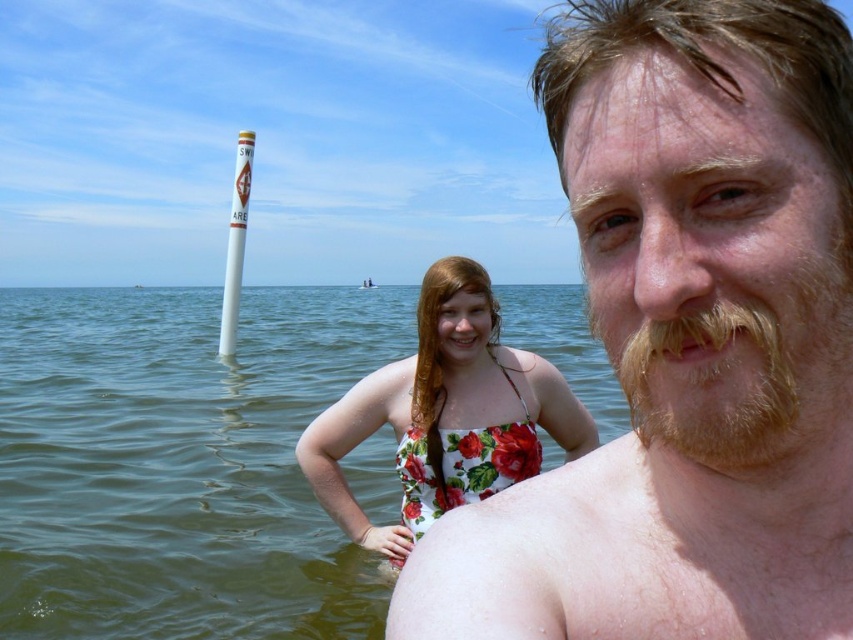
You are a photographer taking a landscape photo of the beach scene. You want to ensure that both the shiny blonde hair at upper right and the light brown fuzzy beard at right are clearly visible in the frame. Based on their heights, which of the two should you focus on first to ensure proper exposure?

The shiny blonde hair at upper right is much taller than the light brown fuzzy beard at right, so you should focus on the shiny blonde hair at upper right first to ensure proper exposure.

Consider the image. You are a photographer taking a picture of the beach scene. You want to ensure both the shiny blonde hair at upper right and the floral print swimsuit at center are clearly visible. Which object should you focus on first to ensure depth of field captures both?

You should focus on the floral print swimsuit at center first because it is closer to the camera than the shiny blonde hair at upper right. By focusing on the closer object, the depth of field will extend backward, potentially keeping both in focus.